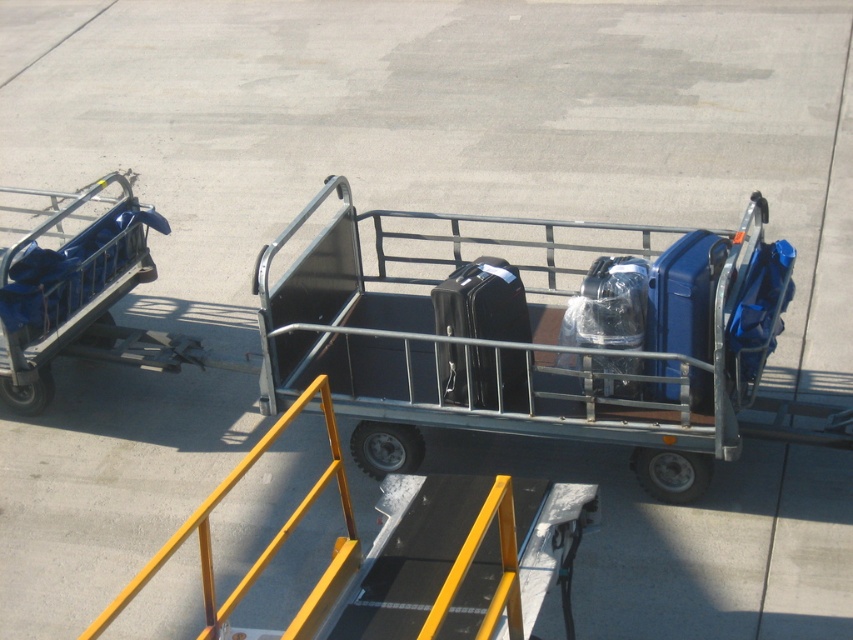
In the scene shown: You are standing at the center of the airport tarmac and see two points marked on the ground. The first point is at coordinate point(561, 332) and the second is at point(704, 394). Which point is closer to you?

Point(561, 332) is behind point(704, 394), so the closer point to you is point(704, 394).